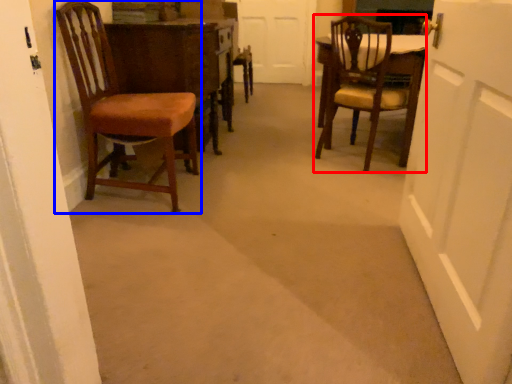
Question: Which object is further to the camera taking this photo, chair (highlighted by a red box) or chair (highlighted by a blue box)?

Choices:
 (A) chair
 (B) chair

Answer: (A)